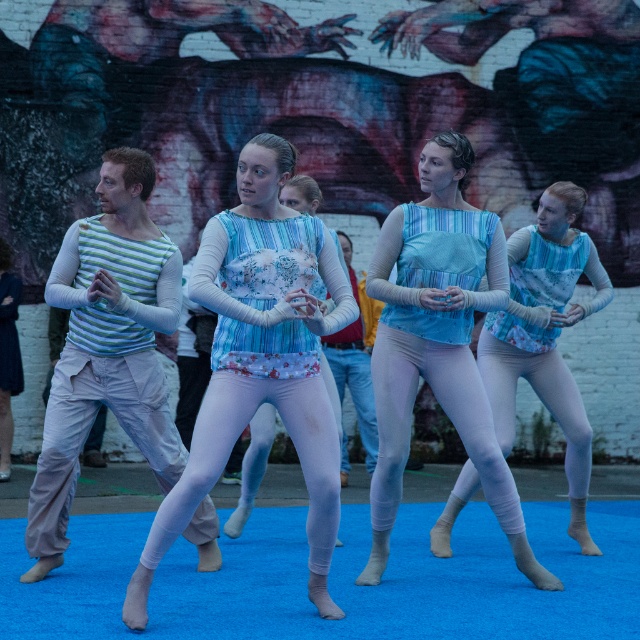
You are a photographer trying to capture the dancers. You notice two blue tank tops at the center of the image. Which one appears nearer to you, the blue floral tank top at center or the blue textured tank top at center?

The blue floral tank top at center appears nearer to you because it is closer to the viewer than the blue textured tank top at center.